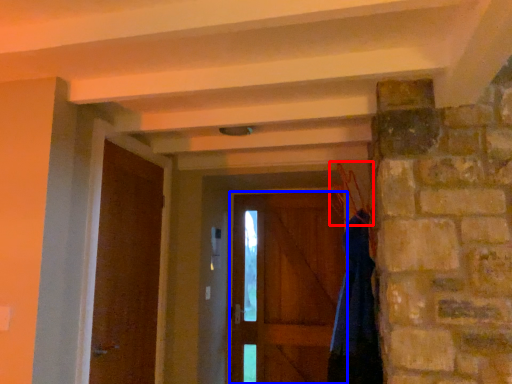
Question: Which object appears closest to the camera in this image, hanger (highlighted by a red box) or door (highlighted by a blue box)?

Choices:
 (A) hanger
 (B) door

Answer: (A)